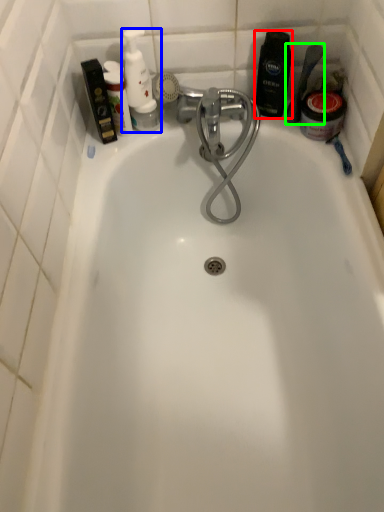
Question: Considering the real-world distances, which object is closest to toiletry (highlighted by a red box)? toiletry (highlighted by a blue box) or shower (highlighted by a green box).

Choices:
 (A) toiletry
 (B) shower

Answer: (B)